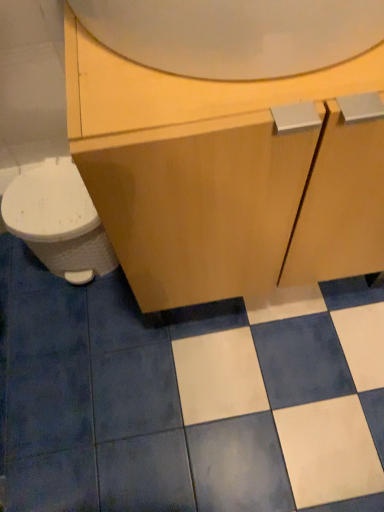
Question: Considering their positions, is white glossy toilet at left located in front of or behind white glossy tile at center?

Choices:
 (A) behind
 (B) front

Answer: (A)

Question: Does point coord(76,273) appear closer or farther from the camera than point coord(110,276)?

Choices:
 (A) farther
 (B) closer

Answer: (B)

Question: Estimate the real-world distances between objects in this image. Which object is farther from the matte wood cabinet at center?

Choices:
 (A) white glossy tile at center
 (B) white glossy mirror at upper center
 (C) white glossy toilet at left

Answer: (A)

Question: Estimate the real-world distances between objects in this image. Which object is closer to the white glossy toilet at left?

Choices:
 (A) white glossy tile at center
 (B) white glossy mirror at upper center
 (C) matte wood cabinet at center

Answer: (A)